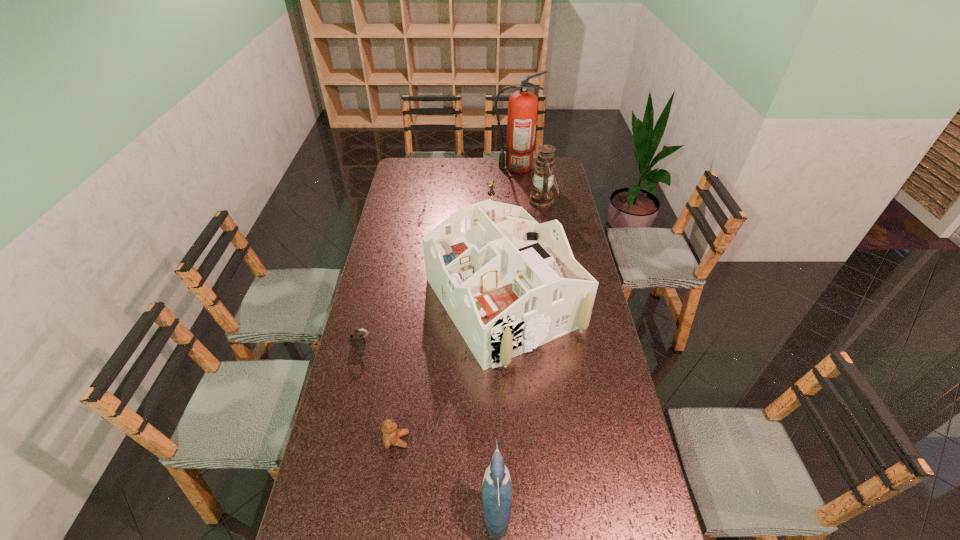
Where is `free region located on the nozzle of the tallest object`? This screenshot has width=960, height=540. free region located on the nozzle of the tallest object is located at coordinates (461, 167).

Locate an element on the screen. vacant space located on the nozzle of the tallest object is located at coordinates (438, 167).

Identify the location of vacant space located 0.200m on the front of the dollhouse. The image size is (960, 540). (510, 429).

Where is `free space located 0.050m on the right of the lantern`? This screenshot has width=960, height=540. free space located 0.050m on the right of the lantern is located at coordinates (566, 201).

In order to click on free space located on the dial number of the telephone in this screenshot , I will do `click(401, 211)`.

Find the location of a particular element. The height and width of the screenshot is (540, 960). free space located 0.160m on the dial number of the telephone is located at coordinates click(x=446, y=211).

This screenshot has height=540, width=960. I want to click on vacant space located on the dial number of the telephone, so click(x=438, y=211).

The width and height of the screenshot is (960, 540). What are the coordinates of `vacant region located 0.230m on the face of the sixth farthest object` in the screenshot? It's located at (486, 440).

Image resolution: width=960 pixels, height=540 pixels. In order to click on vacant space located with the keyhole on the front of the shortest object in this screenshot , I will do `click(352, 387)`.

This screenshot has height=540, width=960. I want to click on object at the far edge, so click(522, 106).